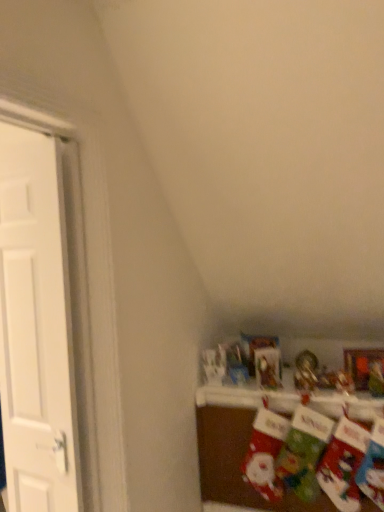
The height and width of the screenshot is (512, 384). What are the coordinates of `matte fabric stockings at lower right` in the screenshot? It's located at (239, 447).

What is the approximate width of matte fabric stockings at lower right?

matte fabric stockings at lower right is 18.45 inches in width.

Describe the element at coordinates (239, 447) in the screenshot. I see `matte fabric stockings at lower right` at that location.

This screenshot has height=512, width=384. I want to click on white matte door at left, so click(36, 328).

Describe the element at coordinates (36, 328) in the screenshot. This screenshot has height=512, width=384. I see `white matte door at left` at that location.

In order to face white matte door at left, should I rotate leftwards or rightwards?

Rotate left and turn 20.401 degrees.

Find the location of a particular element. matte fabric stockings at lower right is located at coordinates (239, 447).

Considering the positions of objects white matte door at left and matte fabric stockings at lower right in the image provided, who is more to the left, white matte door at left or matte fabric stockings at lower right?

white matte door at left is more to the left.

Does white matte door at left lie in front of matte fabric stockings at lower right?

Yes.

Is point (76, 460) farther from viewer compared to point (367, 409)?

No, (76, 460) is closer to viewer.

From the image's perspective, is white matte door at left located above or below matte fabric stockings at lower right?

From the image's perspective, white matte door at left appears above matte fabric stockings at lower right.

From a real-world perspective, which is physically above, white matte door at left or matte fabric stockings at lower right?

In real-world perspective, white matte door at left is above.

Between white matte door at left and matte fabric stockings at lower right, which one has larger width?

With larger width is matte fabric stockings at lower right.

Does white matte door at left have a lesser height compared to matte fabric stockings at lower right?

Incorrect, the height of white matte door at left does not fall short of that of matte fabric stockings at lower right.

Which of these two, white matte door at left or matte fabric stockings at lower right, is bigger?

matte fabric stockings at lower right is bigger.

Is white matte door at left situated inside matte fabric stockings at lower right or outside?

white matte door at left lies outside matte fabric stockings at lower right.

Is white matte door at left far away from matte fabric stockings at lower right?

white matte door at left is far away from matte fabric stockings at lower right.

Is white matte door at left aimed at matte fabric stockings at lower right?

No, white matte door at left is not oriented towards matte fabric stockings at lower right.

How distant is white matte door at left from matte fabric stockings at lower right?

A distance of 1.06 meters exists between white matte door at left and matte fabric stockings at lower right.

In order to click on shelf that is on the right side of white matte door at left in this screenshot , I will do `click(239, 447)`.

Looking at this image, is matte fabric stockings at lower right at the right side of white matte door at left?

Correct, you'll find matte fabric stockings at lower right to the right of white matte door at left.

Which object is further away from the camera, matte fabric stockings at lower right or white matte door at left?

Positioned behind is matte fabric stockings at lower right.

Does point (292, 498) come farther from viewer compared to point (26, 237)?

Yes, it is.

From the image's perspective, relative to white matte door at left, is matte fabric stockings at lower right above or below?

matte fabric stockings at lower right is below white matte door at left.

From a real-world perspective, is matte fabric stockings at lower right above or below white matte door at left?

In terms of real-world spatial position, matte fabric stockings at lower right is below white matte door at left.

Between matte fabric stockings at lower right and white matte door at left, which one has smaller width?

With smaller width is white matte door at left.

Considering the relative sizes of matte fabric stockings at lower right and white matte door at left in the image provided, is matte fabric stockings at lower right shorter than white matte door at left?

Yes, matte fabric stockings at lower right is shorter than white matte door at left.

Which of these two, matte fabric stockings at lower right or white matte door at left, is smaller?

With smaller size is white matte door at left.

Is matte fabric stockings at lower right outside of white matte door at left?

Absolutely, matte fabric stockings at lower right is external to white matte door at left.

Are matte fabric stockings at lower right and white matte door at left beside each other?

matte fabric stockings at lower right and white matte door at left are clearly separated.

Could you tell me if matte fabric stockings at lower right is facing white matte door at left?

No, matte fabric stockings at lower right is not facing towards white matte door at left.

How different are the orientations of matte fabric stockings at lower right and white matte door at left in degrees?

The facing directions of matte fabric stockings at lower right and white matte door at left are 1.3 degrees apart.

You are a GUI agent. You are given a task and a screenshot of the screen. Output one action in this format:
    pyautogui.click(x=<x>, y=<y>)
    Task: Click on the shelf lying on the right of white matte door at left
    The width and height of the screenshot is (384, 512).
    Given the screenshot: What is the action you would take?
    pyautogui.click(x=239, y=447)

Locate an element on the screen. shelf below the white matte door at left (from the image's perspective) is located at coordinates (239, 447).

Identify the location of shelf on the right of white matte door at left. This screenshot has width=384, height=512. (239, 447).